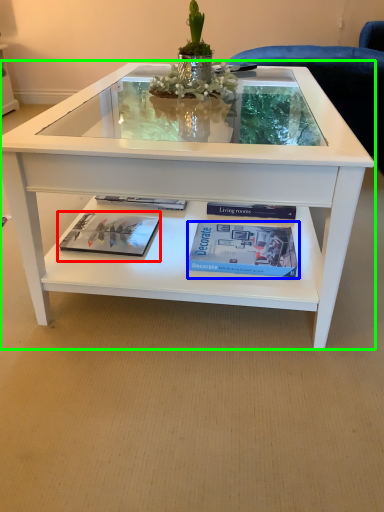
Question: Which is nearer to the magazine (highlighted by a red box)? paperback book (highlighted by a blue box) or coffee table (highlighted by a green box).

Choices:
 (A) paperback book
 (B) coffee table

Answer: (A)